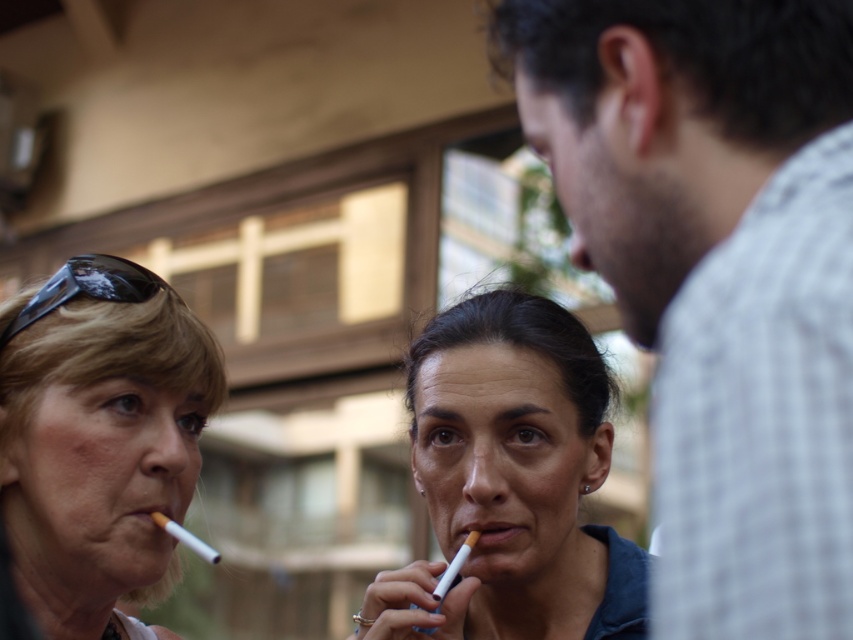
Who is more distant from viewer, (422, 326) or (192, 538)?

The point (422, 326) is behind.

Which is below, matte blue cigarette at center or white matte cigarette at lower left?

white matte cigarette at lower left

At what (x,y) coordinates should I click in order to perform the action: click on matte blue cigarette at center. Please return your answer as a coordinate pair (x, y). This screenshot has height=640, width=853. Looking at the image, I should click on (520, 470).

Is white matte cigarette at lower left closer to the viewer compared to white matte cigarette at center?

No, it is not.

Is point (193, 547) positioned before point (432, 589)?

No, (193, 547) is behind (432, 589).

Who is more forward, (x=210, y=557) or (x=440, y=584)?

Point (x=440, y=584) is more forward.

The height and width of the screenshot is (640, 853). Find the location of `white matte cigarette at lower left`. white matte cigarette at lower left is located at coordinates (186, 538).

Identify the location of white checkered shirt at right. (717, 275).

Image resolution: width=853 pixels, height=640 pixels. Describe the element at coordinates (717, 275) in the screenshot. I see `white checkered shirt at right` at that location.

Is point (584, 4) behind point (74, 291)?

No, it is in front of (74, 291).

Locate an element on the screen. The image size is (853, 640). white checkered shirt at right is located at coordinates (717, 275).